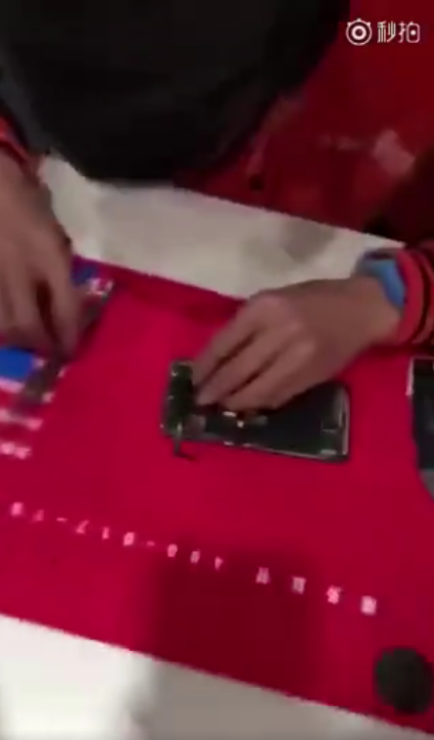
Where is `mat`? Image resolution: width=434 pixels, height=740 pixels. mat is located at coordinates (351, 519).